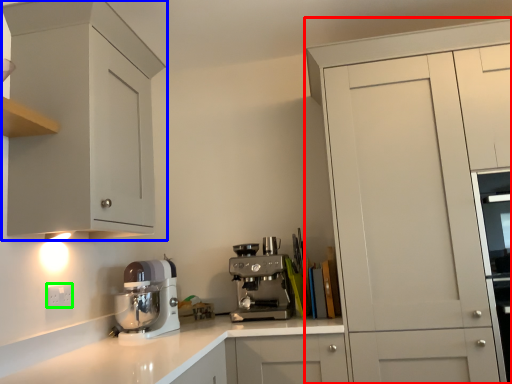
Question: Considering the real-world distances, which object is closest to cabinetry (highlighted by a red box)? cabinetry (highlighted by a blue box) or electric outlet (highlighted by a green box).

Choices:
 (A) cabinetry
 (B) electric outlet

Answer: (A)